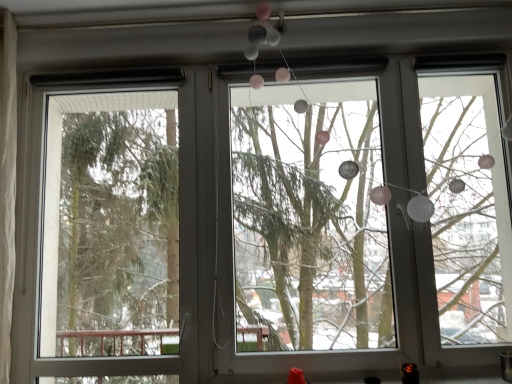
Question: Looking at the image, does matte white garland at center seem bigger or smaller compared to transparent glass screen door at left?

Choices:
 (A) small
 (B) big

Answer: (B)

Question: From the image's perspective, is matte white garland at center positioned above or below transparent glass screen door at left?

Choices:
 (A) above
 (B) below

Answer: (A)

Question: Is point (426, 89) closer or farther from the camera than point (55, 140)?

Choices:
 (A) closer
 (B) farther

Answer: (B)

Question: From a real-world perspective, relative to matte white garland at center, is transparent glass screen door at left vertically above or below?

Choices:
 (A) below
 (B) above

Answer: (A)

Question: Is transparent glass screen door at left bigger or smaller than matte white garland at center?

Choices:
 (A) big
 (B) small

Answer: (B)

Question: In the image, is transparent glass screen door at left positioned in front of or behind matte white garland at center?

Choices:
 (A) front
 (B) behind

Answer: (B)

Question: Considering the positions of transparent glass screen door at left and matte white garland at center in the image, is transparent glass screen door at left wider or thinner than matte white garland at center?

Choices:
 (A) thin
 (B) wide

Answer: (A)